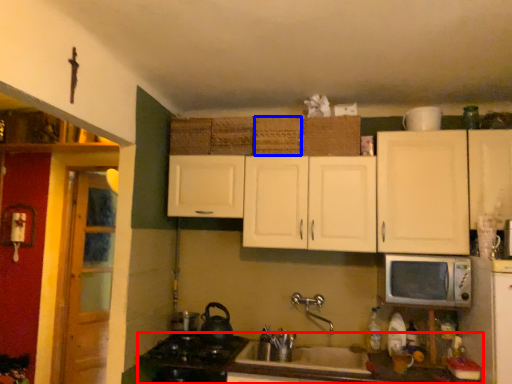
Question: Which point is further to the camera, countertop (highlighted by a red box) or basket (highlighted by a blue box)?

Choices:
 (A) countertop
 (B) basket

Answer: (B)